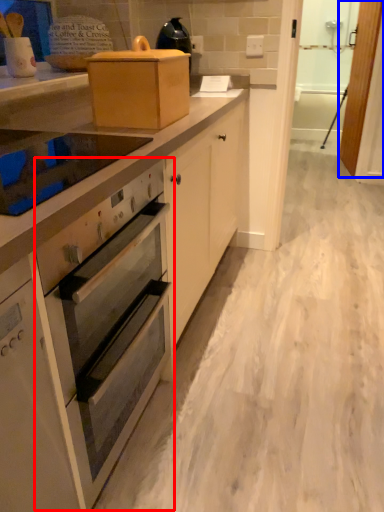
Question: Which of the following is the farthest to the observer, oven (highlighted by a red box) or screen door (highlighted by a blue box)?

Choices:
 (A) oven
 (B) screen door

Answer: (B)